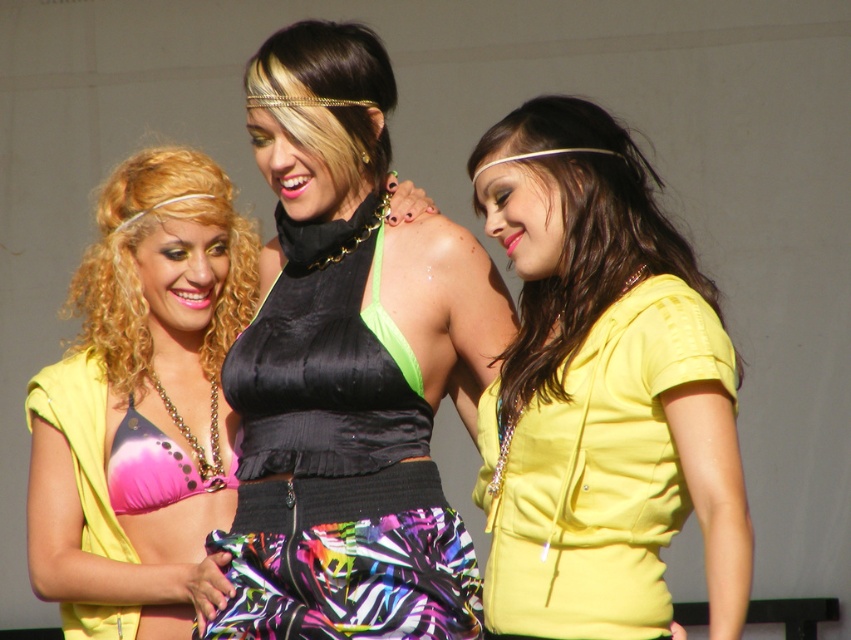
You are a photographer trying to capture the three friends in the scene. The camera you are using has a focus point at coordinate (347,369). Which friend is the camera focusing on?

The camera is focusing on the satin black halter top at center, which belongs to the person in the middle of the group.

You are a photographer trying to capture a group shot of the three people in the scene. The camera you are using has a minimum focus distance of 10 inches. Can you take a photo of both the pink polka dot bikini top at left and the matte black bikini top at center without moving them?

The pink polka dot bikini top at left and the matte black bikini top at center are 9.34 inches apart. Since the distance between them is less than the camera minimum focus distance of 10 inches, you can take a photo of both without moving them.